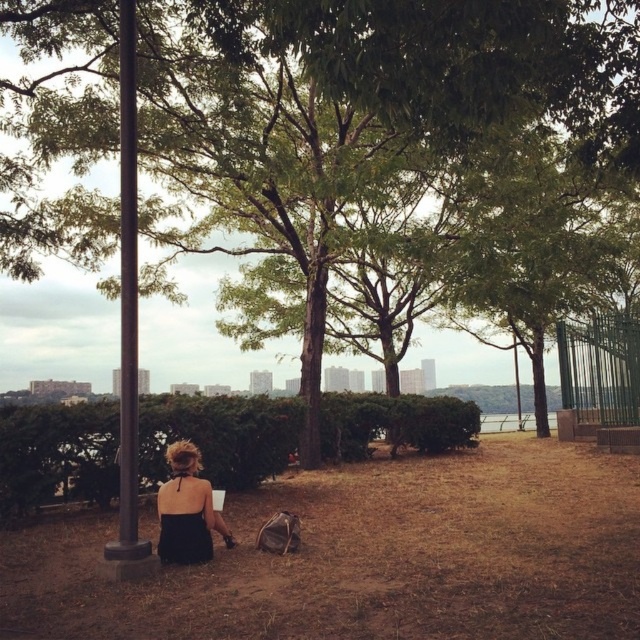
Question: Does black metal pole at left have a larger size compared to black satin dress at lower left?

Choices:
 (A) no
 (B) yes

Answer: (B)

Question: Which object appears farthest from the camera in this image?

Choices:
 (A) black satin dress at lower left
 (B) black metal pole at left

Answer: (A)

Question: Where is black metal pole at left located in relation to black satin dress at lower left in the image?

Choices:
 (A) left
 (B) right

Answer: (A)

Question: Which point is farther from the camera taking this photo?

Choices:
 (A) (132, 417)
 (B) (182, 449)

Answer: (B)

Question: Can you confirm if black metal pole at left is thinner than black satin dress at lower left?

Choices:
 (A) no
 (B) yes

Answer: (B)